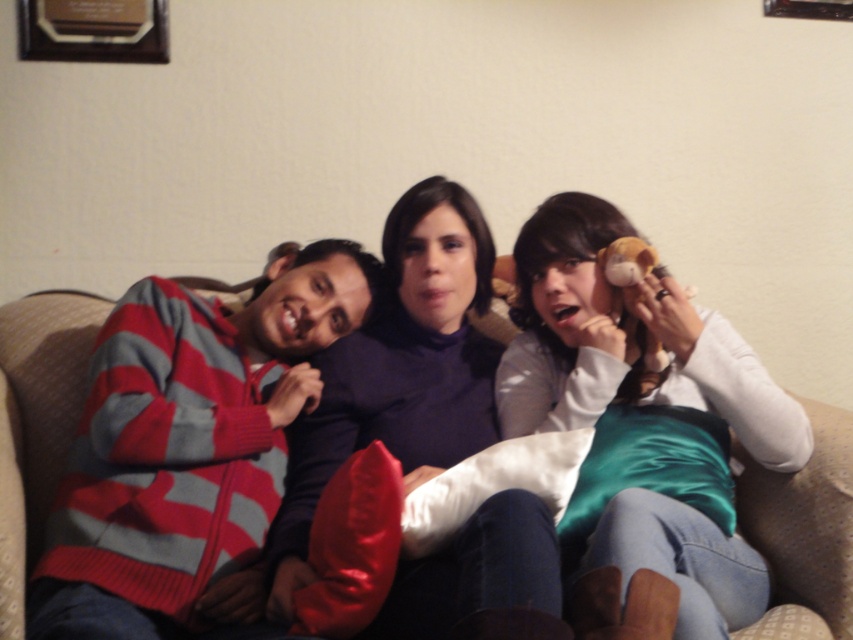
You are a photographer trying to capture a candid shot of the striped knit sweater at left and the white satin pillow at right. The camera you are using has a minimum focus distance of 20 inches. Can you focus on both objects simultaneously without moving the camera?

The striped knit sweater at left is 22.15 inches away from the white satin pillow at right. Since the distance between them is greater than the camera minimum focus distance of 20 inches, the camera can focus on both objects simultaneously without moving.

You are standing in the room and want to place a small gift box at point (189, 451). Is there enough space there?

The point (189, 451) is occupied by the striped knit sweater at left, so there is no space to place the gift box there.

Where is the striped knit sweater at left located in the scene?

The striped knit sweater at left is located at point (x=189, y=451) in the scene.